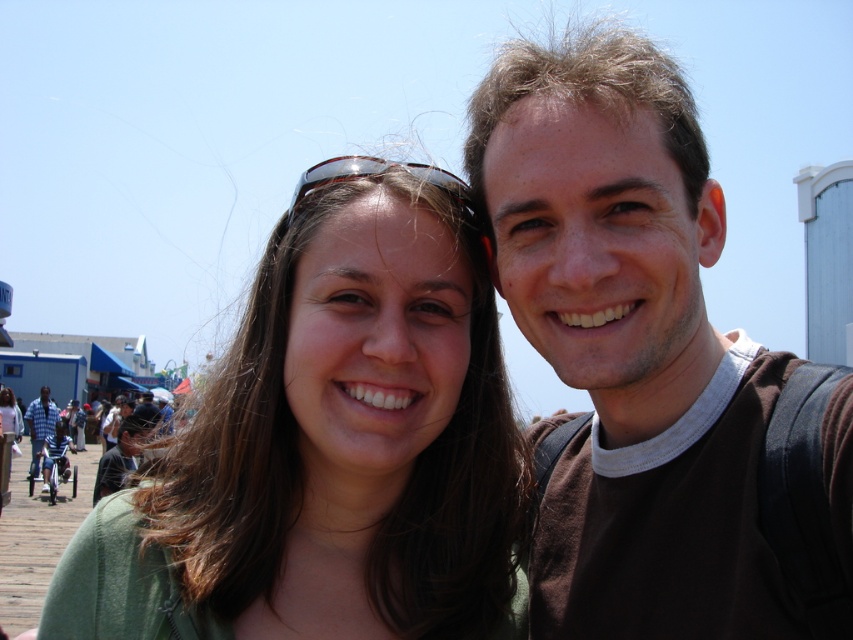
Question: Is brown cotton t-shirt at upper right smaller than sunglasses at center?

Choices:
 (A) yes
 (B) no

Answer: (B)

Question: Among these objects, which one is farthest from the camera?

Choices:
 (A) blue striped shirt at left
 (B) sunglasses at center
 (C) brown cotton t-shirt at upper right

Answer: (A)

Question: Which object is positioned closest to the blue striped shirt at left?

Choices:
 (A) green matte hair at center
 (B) brown cotton t-shirt at upper right
 (C) sunglasses at center

Answer: (A)

Question: Which is nearer to the blue striped shirt at left?

Choices:
 (A) brown cotton t-shirt at upper right
 (B) sunglasses at center
 (C) green matte hair at center

Answer: (C)

Question: Is green matte hair at center positioned at the back of brown cotton t-shirt at upper right?

Choices:
 (A) yes
 (B) no

Answer: (A)

Question: Can you confirm if green matte hair at center is positioned to the left of sunglasses at center?

Choices:
 (A) yes
 (B) no

Answer: (B)